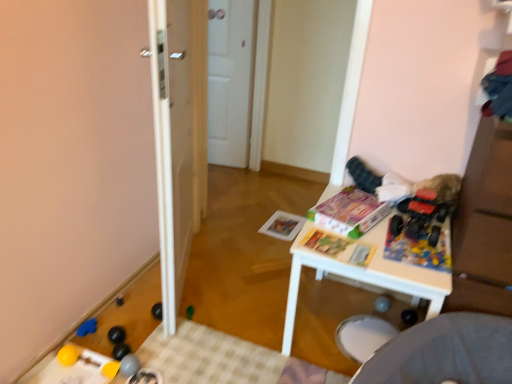
What are the coordinates of `free space behind rubber yellow ball at lower left, which is the 4th toy from right to left` in the screenshot? It's located at (126, 340).